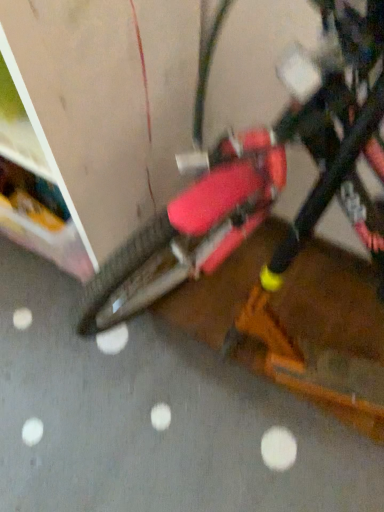
Question: In terms of height, does matte red bicycle at center look taller or shorter compared to matte orange scooter at center?

Choices:
 (A) short
 (B) tall

Answer: (B)

Question: Is matte red bicycle at center spatially inside matte orange scooter at center, or outside of it?

Choices:
 (A) inside
 (B) outside

Answer: (B)

Question: Is point (180, 228) closer or farther from the camera than point (41, 419)?

Choices:
 (A) closer
 (B) farther

Answer: (A)

Question: Does point (1, 481) appear closer or farther from the camera than point (89, 327)?

Choices:
 (A) closer
 (B) farther

Answer: (B)

Question: From a real-world perspective, relative to matte red bicycle at center, is matte orange scooter at center vertically above or below?

Choices:
 (A) above
 (B) below

Answer: (B)

Question: In the image, is matte orange scooter at center positioned in front of or behind matte red bicycle at center?

Choices:
 (A) behind
 (B) front

Answer: (A)

Question: Visually, is matte orange scooter at center positioned to the left or to the right of matte red bicycle at center?

Choices:
 (A) left
 (B) right

Answer: (A)